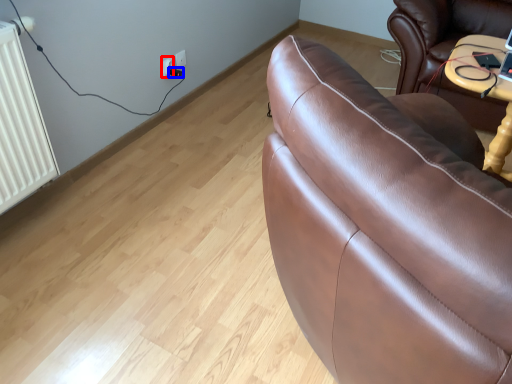
Question: Among these objects, which one is farthest to the camera, electric outlet (highlighted by a red box) or plug (highlighted by a blue box)?

Choices:
 (A) electric outlet
 (B) plug

Answer: (B)